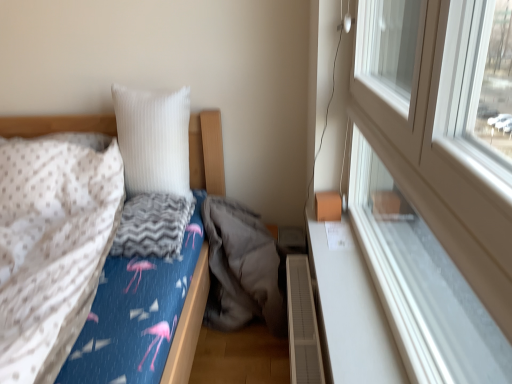
Where is `empty space that is ontop of white plastic radiator at lower right (from a real-world perspective)`? Image resolution: width=512 pixels, height=384 pixels. empty space that is ontop of white plastic radiator at lower right (from a real-world perspective) is located at coordinates (308, 297).